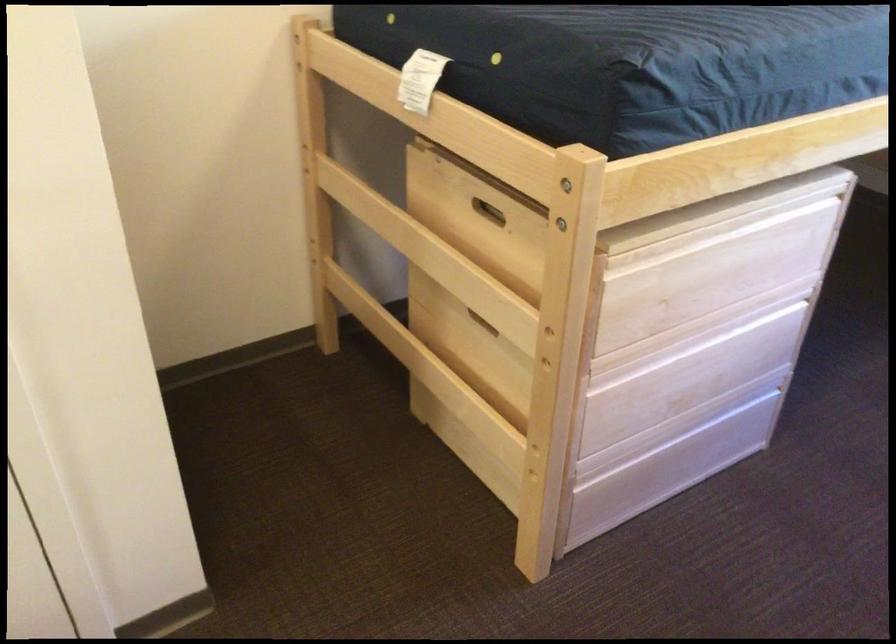
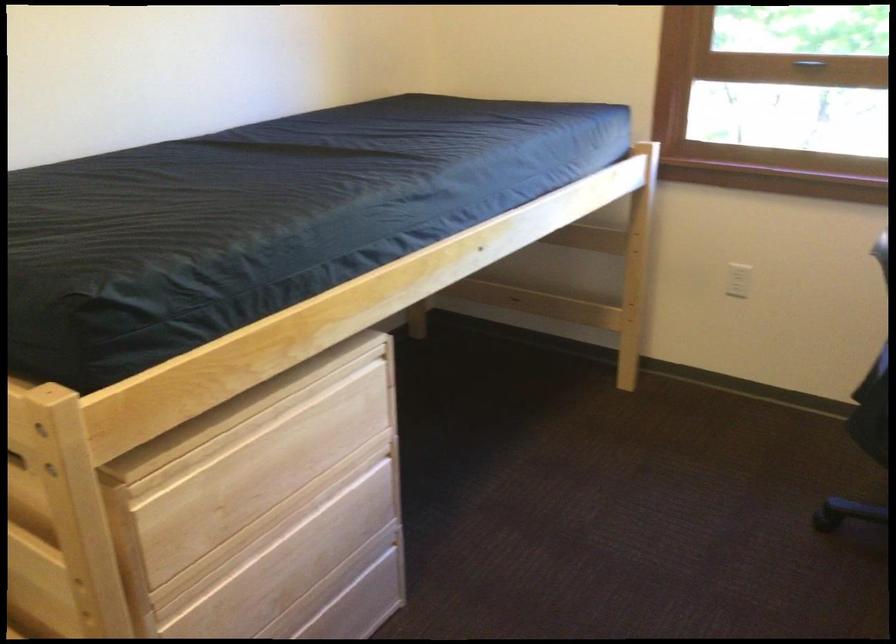
The point at [728,261] is marked in the first image. Where is the corresponding point in the second image?

(285, 448)